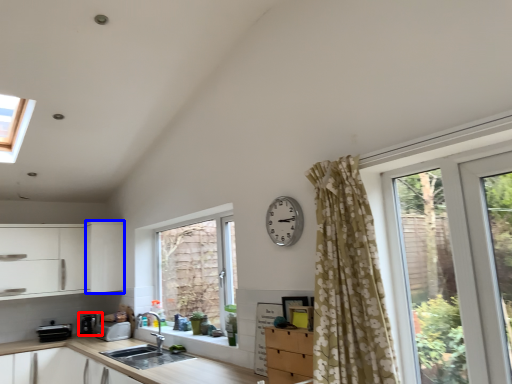
Question: Which point is further to the camera, appliance (highlighted by a red box) or cabinetry (highlighted by a blue box)?

Choices:
 (A) appliance
 (B) cabinetry

Answer: (A)